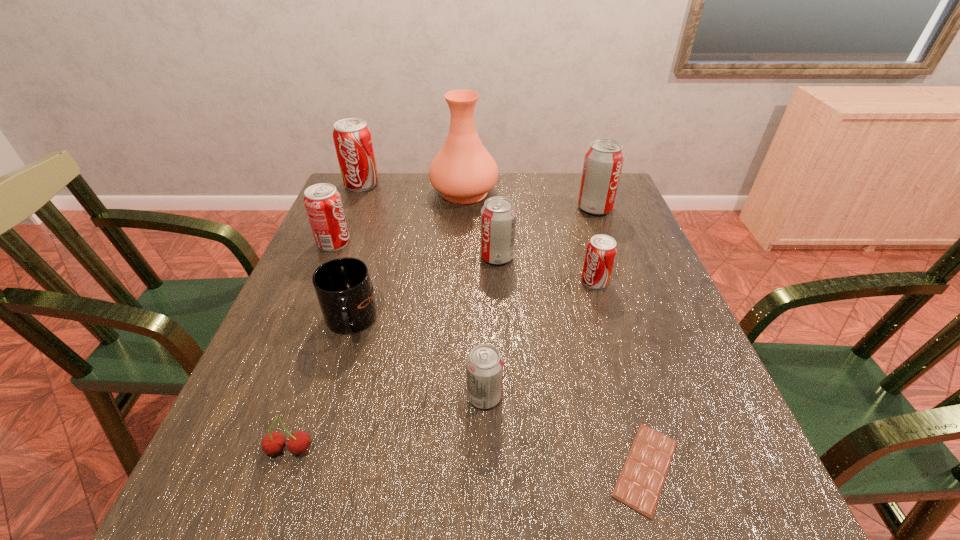
At what (x,y) coordinates should I click in order to perform the action: click on the tallest object. Please return your answer as a coordinate pair (x, y). This screenshot has width=960, height=540. Looking at the image, I should click on (463, 171).

Find the location of a particular element. the biggest red soda can is located at coordinates (352, 137).

Where is `the farthest red soda can`? the farthest red soda can is located at coordinates (352, 137).

At what (x,y) coordinates should I click in order to perform the action: click on the rightmost gray soda can. Please return your answer as a coordinate pair (x, y). The image size is (960, 540). Looking at the image, I should click on (603, 162).

The image size is (960, 540). I want to click on the second farthest soda can, so tap(603, 162).

Identify the location of the second farthest gray soda can. The width and height of the screenshot is (960, 540). (x=498, y=215).

Locate an element on the screen. the second nearest red soda can is located at coordinates (323, 203).

Where is `mug`? This screenshot has height=540, width=960. mug is located at coordinates (343, 286).

Locate an element on the screen. The width and height of the screenshot is (960, 540). black mug is located at coordinates (343, 286).

Locate an element on the screen. Image resolution: width=960 pixels, height=540 pixels. the fifth nearest object is located at coordinates (601, 251).